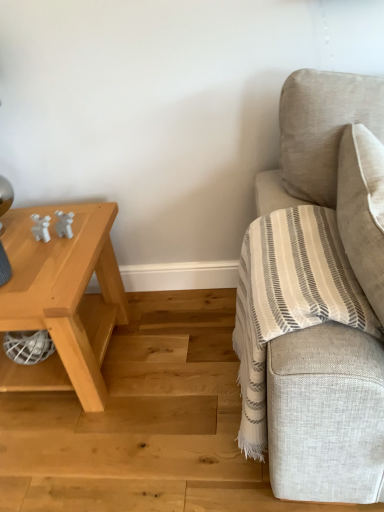
You are a GUI agent. You are given a task and a screenshot of the screen. Output one action in this format:
    pyautogui.click(x=<x>, y=<y>)
    Task: Click on the free space in front of light wood table at left
    The width and height of the screenshot is (384, 512).
    Given the screenshot: What is the action you would take?
    pyautogui.click(x=85, y=459)